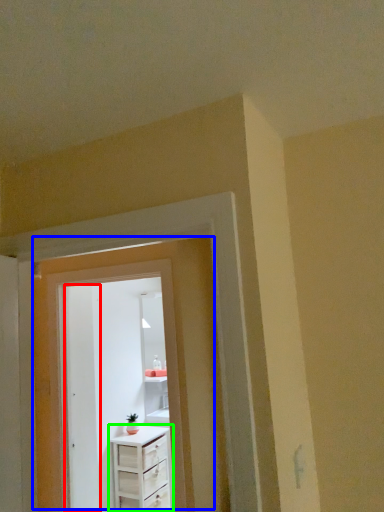
Question: Which is nearer to the door (highlighted by a red box)? door (highlighted by a blue box) or chest of drawers (highlighted by a green box).

Choices:
 (A) door
 (B) chest of drawers

Answer: (B)